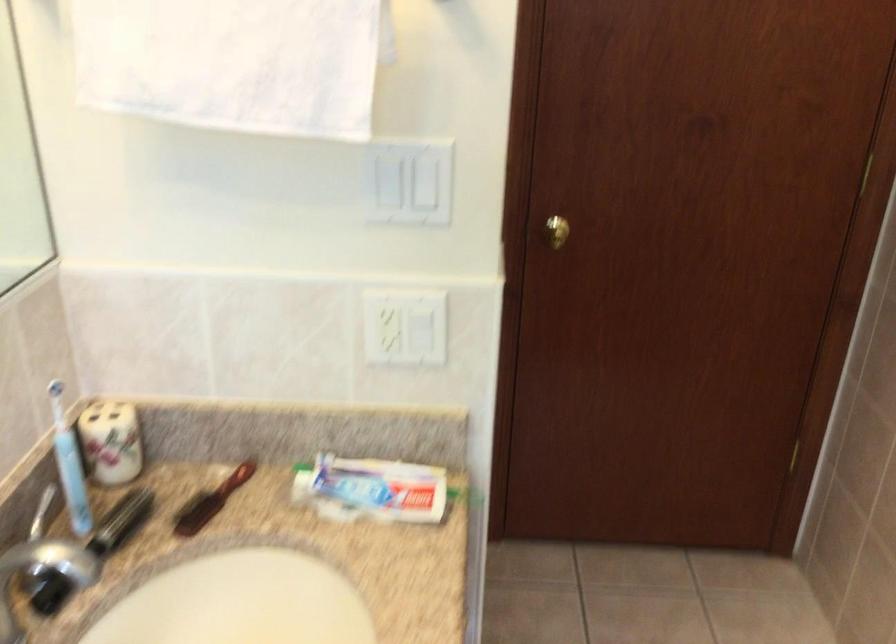
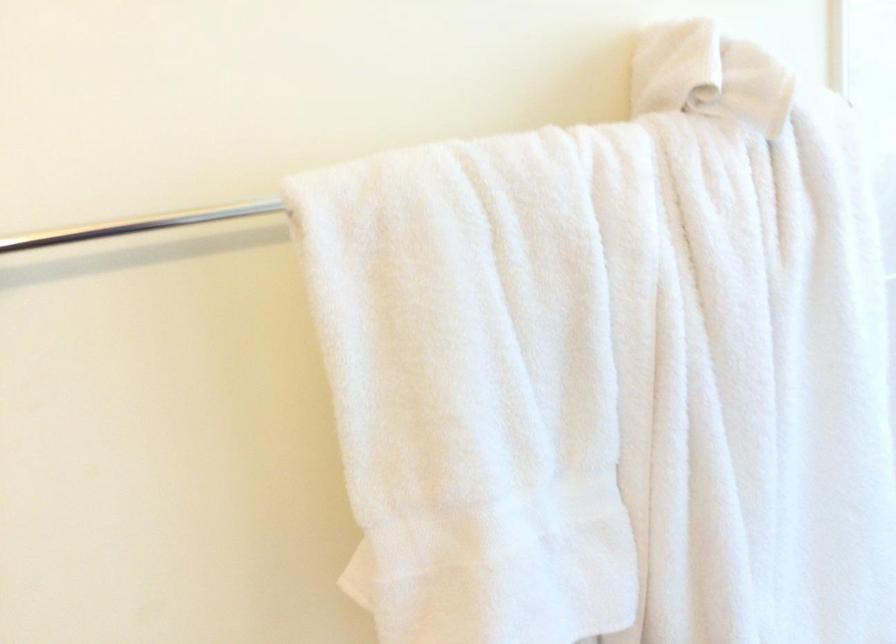
The first image is from the beginning of the video and the second image is from the end. How did the camera likely rotate when shooting the video?

The camera's rotation is toward right-down.